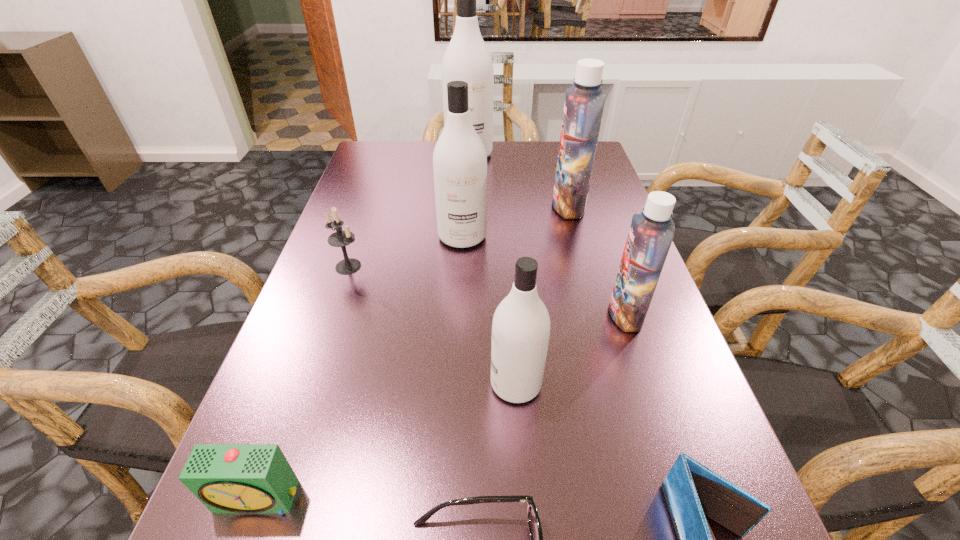
You are a GUI agent. You are given a task and a screenshot of the screen. Output one action in this format:
    pyautogui.click(x=<x>, y=<y>)
    Task: Click on the free space that satisfies the following two spatial constraints: 1. on the front label of the nearer blue shampoo; 2. on the front-facing side of the alarm clock
    The image size is (960, 540).
    Given the screenshot: What is the action you would take?
    pyautogui.click(x=687, y=498)